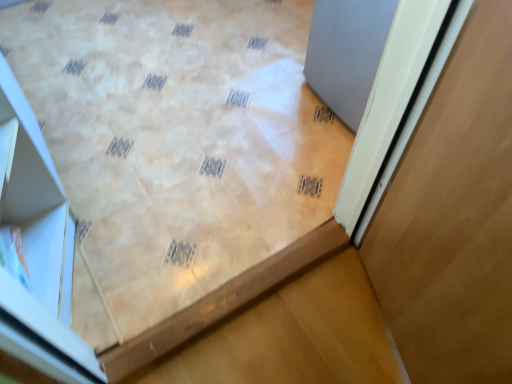
What is the approximate height of beige glossy tile at center?

The height of beige glossy tile at center is 2.16 inches.

Find the location of `beige glossy tile at center`. beige glossy tile at center is located at coordinates (177, 147).

What do you see at coordinates (177, 147) in the screenshot? I see `beige glossy tile at center` at bounding box center [177, 147].

The height and width of the screenshot is (384, 512). I want to click on beige glossy tile at center, so click(177, 147).